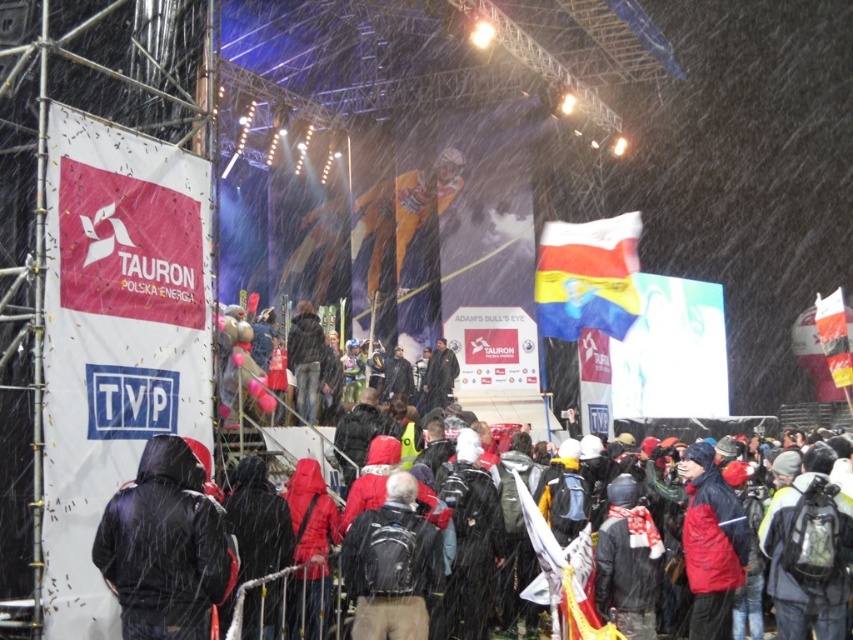
You are a photographer at the event and want to capture a photo of the black matte jacket at center without the white fabric flag at right appearing in the background. Based on their positions, is this possible?

The black matte jacket at center is positioned under the white fabric flag at right, so adjusting the camera angle downward would allow capturing the jacket without the flag in the background.

You are a photographer trying to capture a clear shot of the black matte jacket at center and the white fabric flag at right. Since the scene is under heavy snowfall, you want to know which object might be more visible due to its height. Which one is taller?

The white fabric flag at right is taller than the black matte jacket at center, so it would be more visible in the snowfall due to its height.

You are a photographer at the event and need to capture a closeup of the two jackets. Since the black matte jacket at center and dark blue jacket at center are very close to each other, will you need to adjust your camera focus to account for their different thicknesses?

The black matte jacket at center is thinner than the dark blue jacket at center, so you will need to adjust your camera focus to ensure both are in sharp focus due to their differing thicknesses.